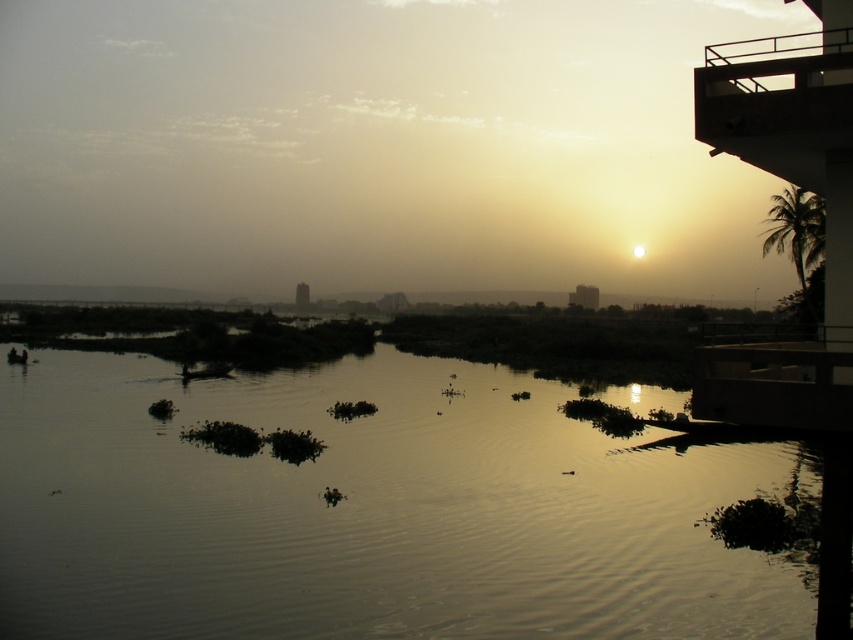
Does silvery reflective water at center have a lesser height compared to metallic balcony at upper right?

Yes.

Does silvery reflective water at center have a larger size compared to metallic balcony at upper right?

Incorrect, silvery reflective water at center is not larger than metallic balcony at upper right.

Who is more forward, (494, 435) or (846, 49)?

Point (846, 49) is in front.

Locate an element on the screen. silvery reflective water at center is located at coordinates (370, 509).